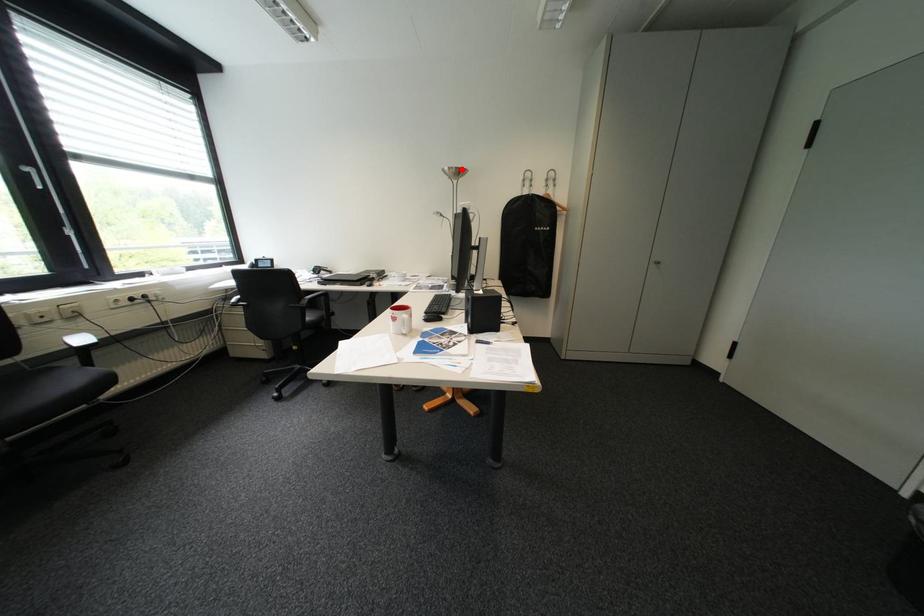
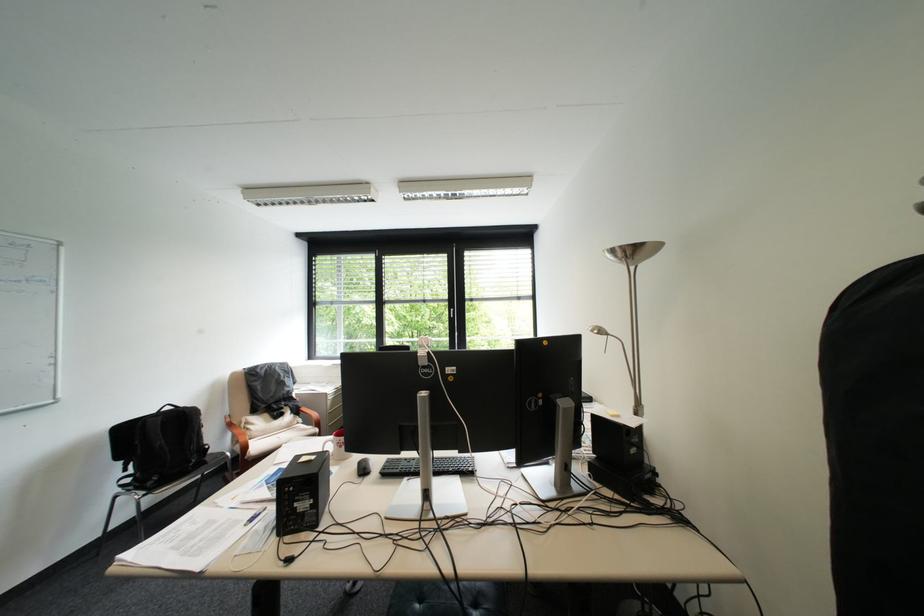
Locate, in the second image, the point that corresponds to the highlighted location in the first image.

(625, 252)